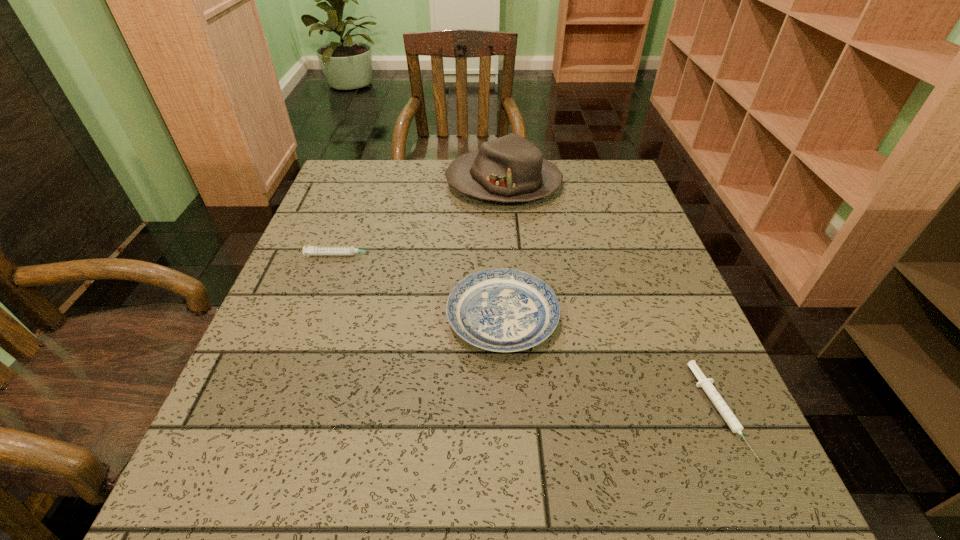
What are the coordinates of `free space located on the decorative side of the hat` in the screenshot? It's located at (360, 184).

Locate an element on the screen. vacant space located on the left of the second nearest object is located at coordinates (355, 317).

The height and width of the screenshot is (540, 960). In order to click on vacant region located at the needle end of the farther syringe in this screenshot , I will do `click(419, 255)`.

Locate an element on the screen. The width and height of the screenshot is (960, 540). vacant space located 0.060m on the back of the right syringe is located at coordinates click(686, 339).

Find the location of `object that is at the far edge`. object that is at the far edge is located at coordinates [x=511, y=168].

Identify the location of object that is at the near edge. (706, 384).

You are a GUI agent. You are given a task and a screenshot of the screen. Output one action in this format:
    pyautogui.click(x=<x>, y=<y>)
    Task: Click on the object that is at the left edge
    Image resolution: width=960 pixels, height=540 pixels.
    Given the screenshot: What is the action you would take?
    pyautogui.click(x=309, y=250)

At what (x,y) coordinates should I click in order to perform the action: click on object located at the right edge. Please return your answer as a coordinate pair (x, y). This screenshot has height=540, width=960. Looking at the image, I should click on (706, 384).

Where is `object that is at the near right corner`? The image size is (960, 540). object that is at the near right corner is located at coordinates (706, 384).

Locate an element on the screen. Image resolution: width=960 pixels, height=540 pixels. free region at the far edge is located at coordinates (444, 167).